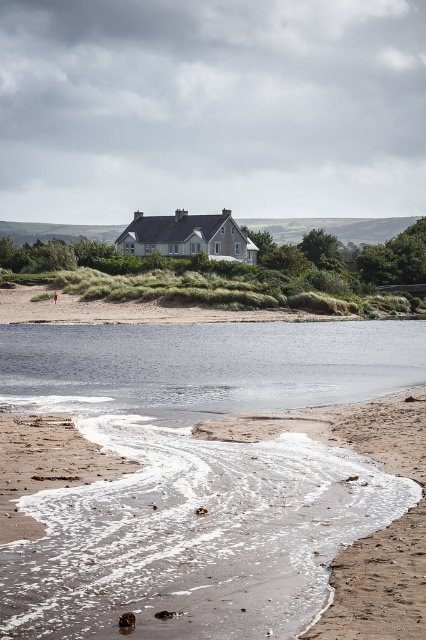
You are standing at the beach looking at the scene. There are two points marked in the image. Which point, point (123, 496) or point (14, 332), is closer to you?

Point (123, 496) is closer to the camera than point (14, 332).